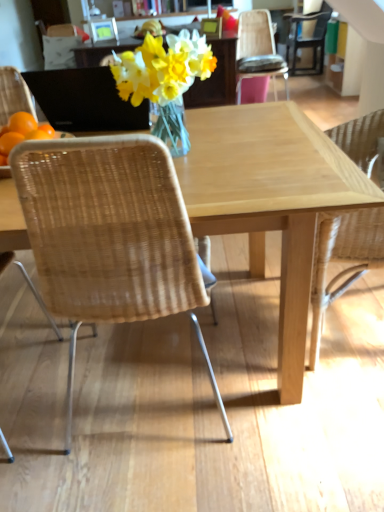
Question: Considering the positions of point (56, 105) and point (294, 31), is point (56, 105) closer or farther from the camera than point (294, 31)?

Choices:
 (A) farther
 (B) closer

Answer: (B)

Question: Would you say black matte laptop at upper left is inside or outside matte black chair at upper right, which is counted as the 4th chair, starting from the front?

Choices:
 (A) outside
 (B) inside

Answer: (A)

Question: Estimate the real-world distances between objects in this image. Which object is closer to the natural wicker chair at right, arranged as the 2th chair when viewed from the front?

Choices:
 (A) woven wood chair at upper right, positioned as the third chair in front-to-back order
 (B) matte black chair at upper right, which is the 1th chair from back to front
 (C) natural wood table at center
 (D) translucent glass vase at center
 (E) woven wood chair at left, acting as the fourth chair starting from the back

Answer: (C)

Question: Estimate the real-world distances between objects in this image. Which object is closer to the woven wood chair at upper right, placed as the 3th chair when sorted from left to right?

Choices:
 (A) woven wood chair at left, which is counted as the fourth chair, starting from the top
 (B) matte black chair at upper right, the 4th chair when ordered from bottom to top
 (C) natural wood table at center
 (D) black matte laptop at upper left
 (E) translucent glass vase at center

Answer: (B)